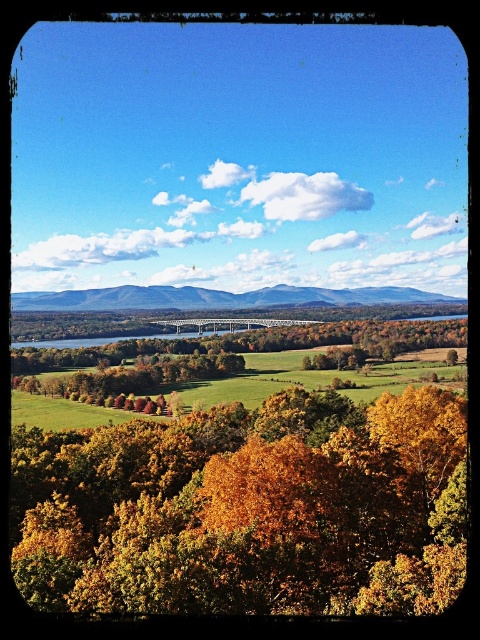
Who is shorter, golden leafy trees at center or green grassy field at lower center?

green grassy field at lower center

How much distance is there between golden leafy trees at center and green grassy field at lower center?

golden leafy trees at center is 795.12 feet from green grassy field at lower center.

Between point (431, 588) and point (50, 291), which one is positioned in front?

Point (431, 588)

Find the location of a particular element. golden leafy trees at center is located at coordinates (248, 508).